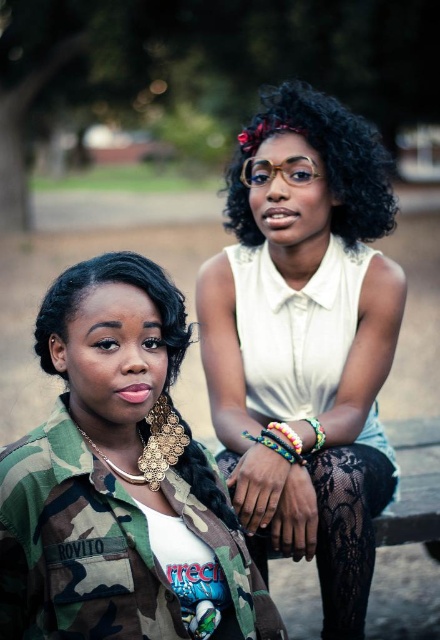
Question: Which object appears farthest from the camera in this image?

Choices:
 (A) white matte blouse at center
 (B) camo fabric at lower right
 (C) multicolored woven bracelet at center
 (D) curly black hair at upper center

Answer: (D)

Question: Which point appears farthest from the camera in this image?

Choices:
 (A) (385, 451)
 (B) (370, 472)

Answer: (A)

Question: Which point is farther to the camera?

Choices:
 (A) (278, 442)
 (B) (175, 432)

Answer: (A)

Question: Is curly black hair at upper center thinner than multicolored woven bracelet at center?

Choices:
 (A) no
 (B) yes

Answer: (A)

Question: Is multicolored fabric bracelet at lower center further to the viewer compared to multicolored woven bracelet at center?

Choices:
 (A) no
 (B) yes

Answer: (A)

Question: Is camo fabric at lower right positioned behind multicolored woven bracelet at center?

Choices:
 (A) yes
 (B) no

Answer: (B)